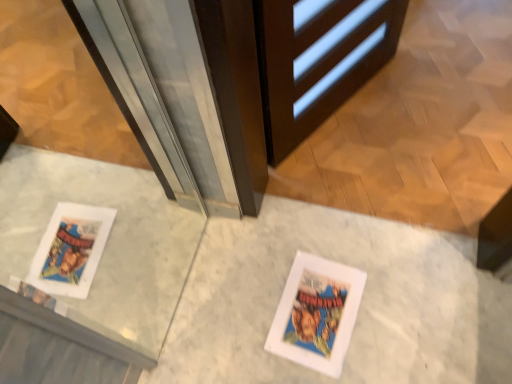
In order to face matte white comic book at center, should I rotate leftwards or rightwards?

To align with it, rotate right about 8.218°.

Measure the distance between point (327, 280) and camera.

The depth of point (327, 280) is 1.22 meters.

What do you see at coordinates (317, 313) in the screenshot? I see `matte white comic book at center` at bounding box center [317, 313].

Identify the location of matte white comic book at center. (317, 313).

You are a GUI agent. You are given a task and a screenshot of the screen. Output one action in this format:
    pyautogui.click(x=<x>, y=<y>)
    Task: Click on the matte white comic book at center
    The height and width of the screenshot is (384, 512).
    Given the screenshot: What is the action you would take?
    (x=317, y=313)